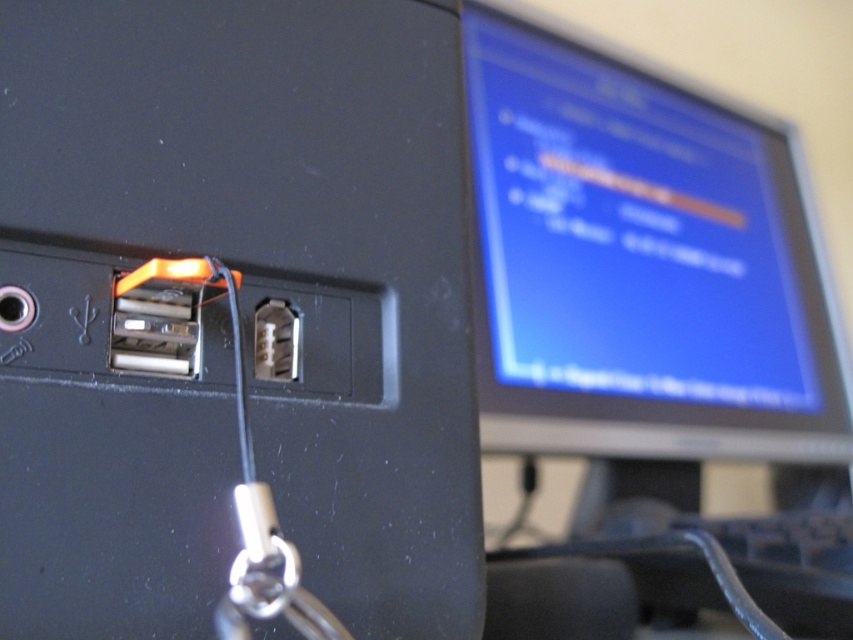
Question: Can you confirm if black plastic keyboard at lower right is positioned below silver metallic keychain at bottom center?

Choices:
 (A) no
 (B) yes

Answer: (B)

Question: Which object is positioned closest to the silver metallic keychain at bottom center?

Choices:
 (A) black plastic keyboard at lower right
 (B) matte black usb port at center
 (C) metallic silver socket at center

Answer: (C)

Question: Is matte black usb port at center to the right of metallic silver socket at center from the viewer's perspective?

Choices:
 (A) yes
 (B) no

Answer: (A)

Question: Is matte black usb port at center wider than metallic silver socket at center?

Choices:
 (A) no
 (B) yes

Answer: (B)

Question: Which object appears closest to the camera in this image?

Choices:
 (A) matte black usb port at center
 (B) metallic silver socket at center
 (C) black plastic keyboard at lower right

Answer: (A)

Question: Which of the following is the farthest from the observer?

Choices:
 (A) matte black usb port at center
 (B) silver metallic keychain at bottom center
 (C) metallic silver socket at center
 (D) black plastic keyboard at lower right

Answer: (C)